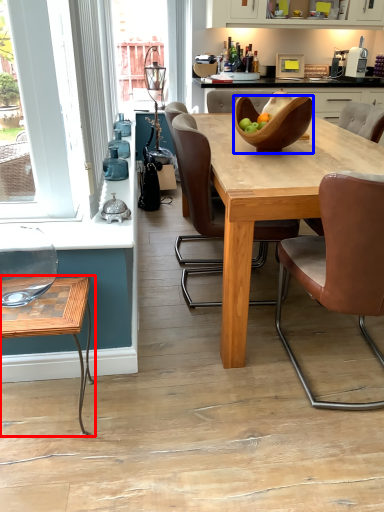
Question: Among these objects, which one is nearest to the camera, coffee table (highlighted by a red box) or bowl (highlighted by a blue box)?

Choices:
 (A) coffee table
 (B) bowl

Answer: (A)